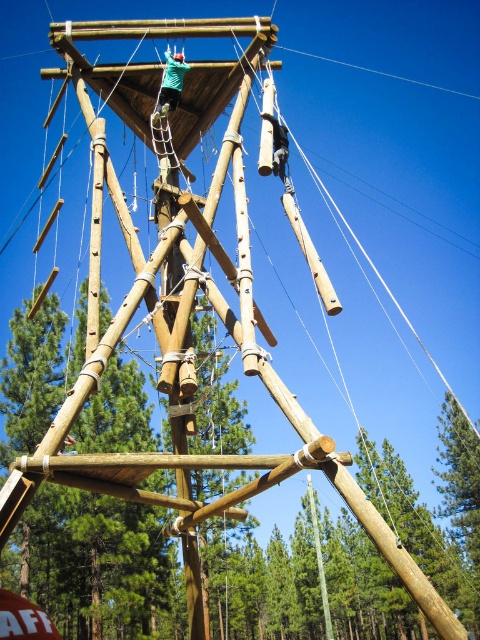
Question: Which point is closer to the camera?

Choices:
 (A) (324, 600)
 (B) (143, 572)

Answer: (B)

Question: Is natural wood pole at center wider than smooth bamboo pole at center?

Choices:
 (A) yes
 (B) no

Answer: (A)

Question: Can you confirm if natural wood pole at center is positioned below smooth bamboo pole at center?

Choices:
 (A) yes
 (B) no

Answer: (B)

Question: Is natural wood pole at center below smooth bamboo pole at center?

Choices:
 (A) no
 (B) yes

Answer: (A)

Question: Among these objects, which one is nearest to the camera?

Choices:
 (A) natural wood pole at center
 (B) smooth bamboo pole at center

Answer: (A)